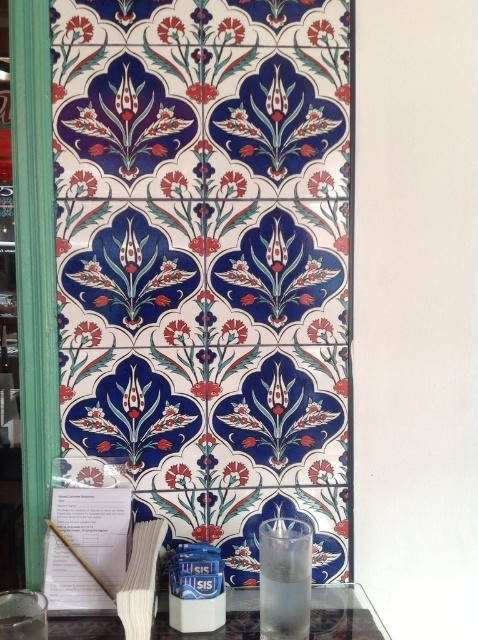
You are a delivery person who needs to place a package on the table. The package is 14 inches long. There is a space between the porcelain tiles at center and the transparent glass at lower center. Can you fit the package horizontally in that space?

The porcelain tiles at center is 13.76 inches from transparent glass at lower center. Since the package is 14 inches long, it cannot fit horizontally in the space between them as the distance is slightly shorter than the package length.